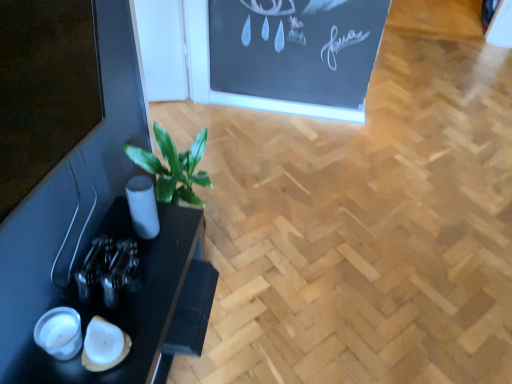
The image size is (512, 384). I want to click on unoccupied region to the right of metallic glass bottle at left, so click(x=161, y=287).